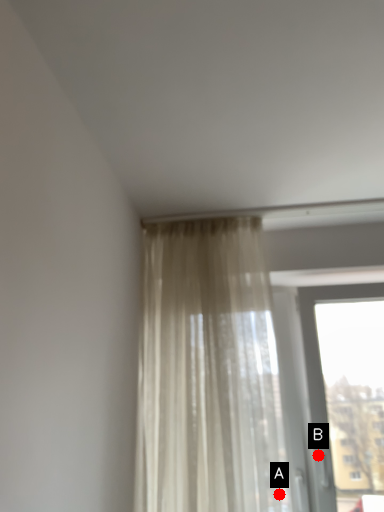
Question: Two points are circled on the image, labeled by A and B beside each circle. Which point is closer to the camera?

Choices:
 (A) A is closer
 (B) B is closer

Answer: (A)